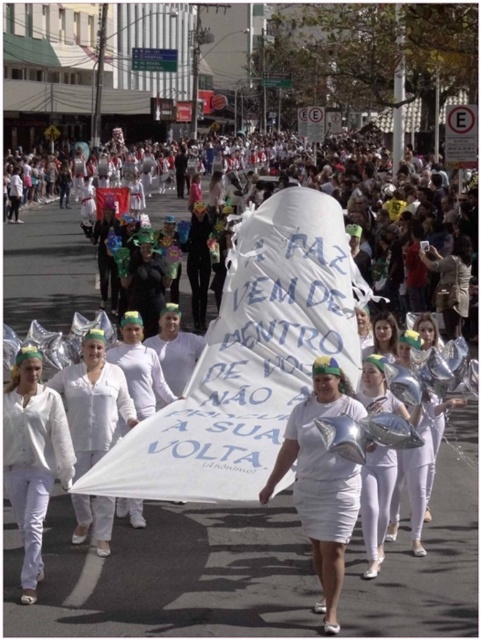
Question: From the image, what is the correct spatial relationship of white fabric banner at center in relation to white matte dress at center?

Choices:
 (A) right
 (B) left

Answer: (B)

Question: Which object is positioned closest to the white matte dress at center?

Choices:
 (A) matte white dress at center
 (B) white fabric banner at center
 (C) white matte uniform at center
 (D) white matte shirt at center

Answer: (C)

Question: Which of the following is the closest to the observer?

Choices:
 (A) (375, 400)
 (B) (351, 416)

Answer: (B)

Question: Is white matte uniform at center smaller than white matte shirt at center?

Choices:
 (A) no
 (B) yes

Answer: (A)

Question: Which object is farther from the camera taking this photo?

Choices:
 (A) white matte dress at center
 (B) white glossy balloon at center
 (C) white matte uniform at center
 (D) white fabric banner at center

Answer: (D)

Question: Can you confirm if white fabric banner at center is bigger than white matte uniform at center?

Choices:
 (A) yes
 (B) no

Answer: (A)